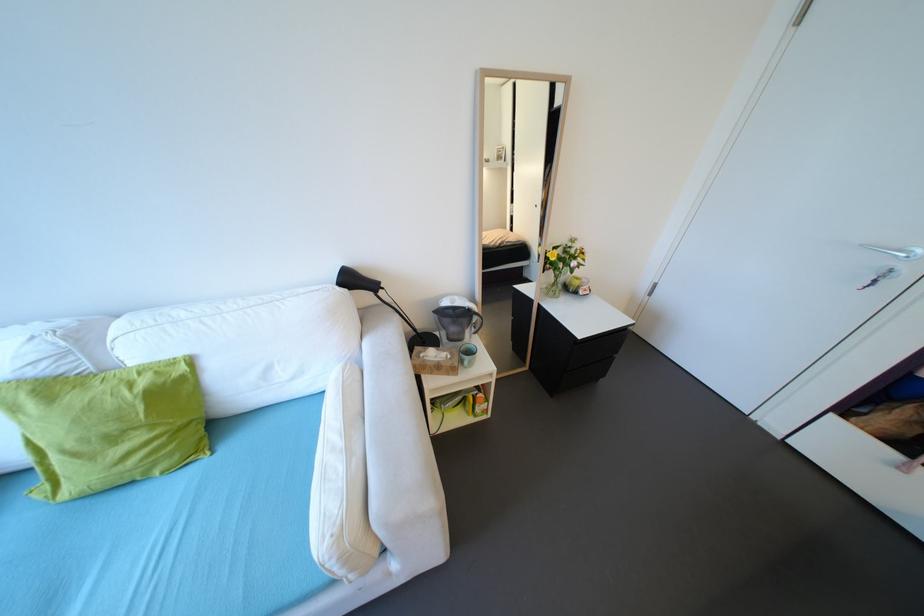
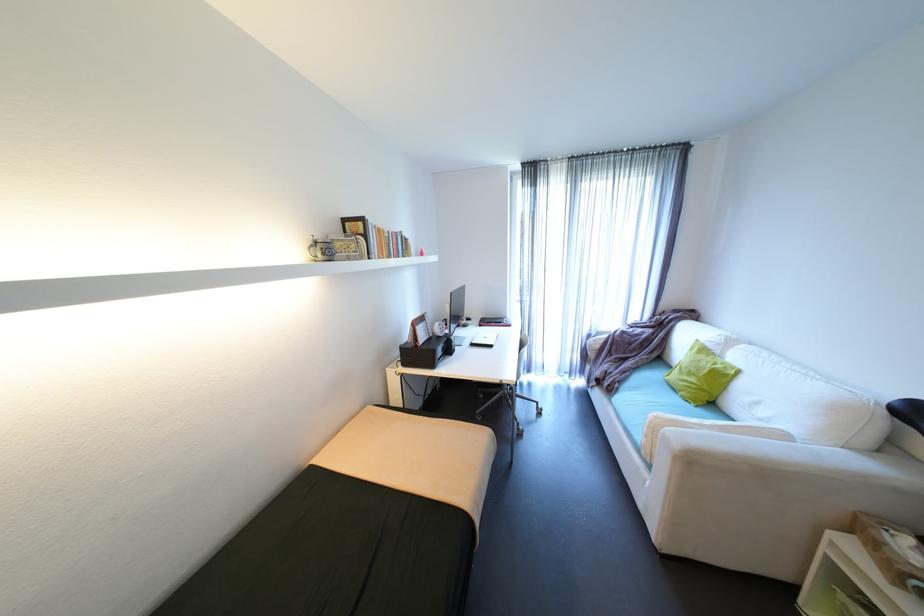
The point at (x=198, y=361) is marked in the first image. Where is the corresponding point in the second image?

(747, 371)